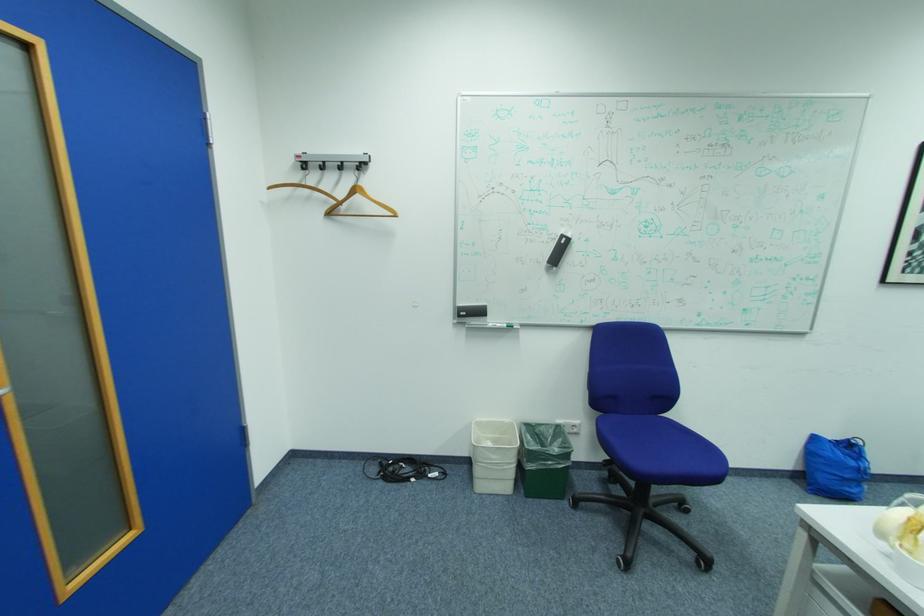
Where is `blue tote bag`? The width and height of the screenshot is (924, 616). blue tote bag is located at coordinates (835, 467).